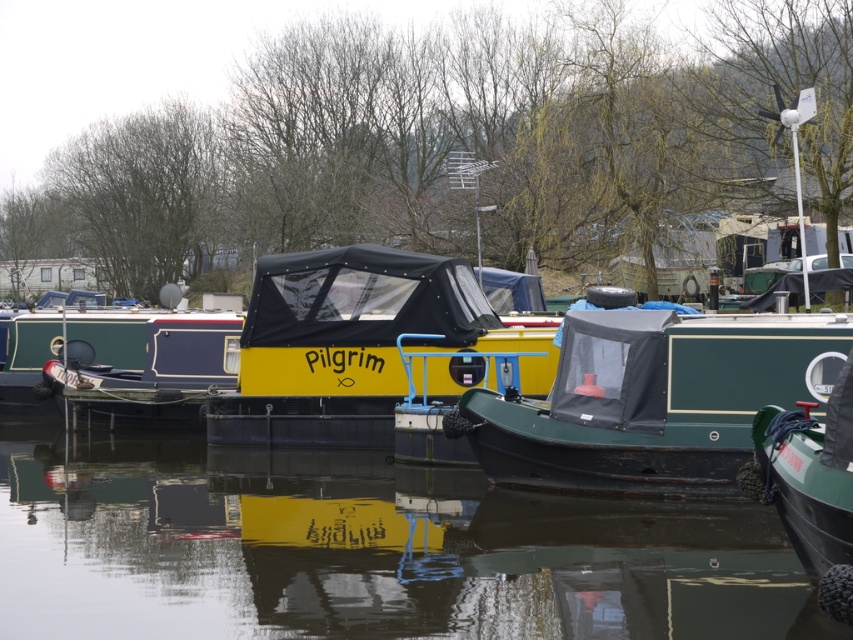
You are standing on the dock and looking at the green matte boat at center and the yellow matte boat at center. Which boat is positioned lower in the image?

The green matte boat at center is positioned below the yellow matte boat at center, so it is lower in the image.

You are planning to board the yellow matte boat at center and the green matte boat at right. Based on their sizes, which boat will provide more space for your luggage?

The yellow matte boat at center is larger in size than the green matte boat at right, so it will provide more space for your luggage.